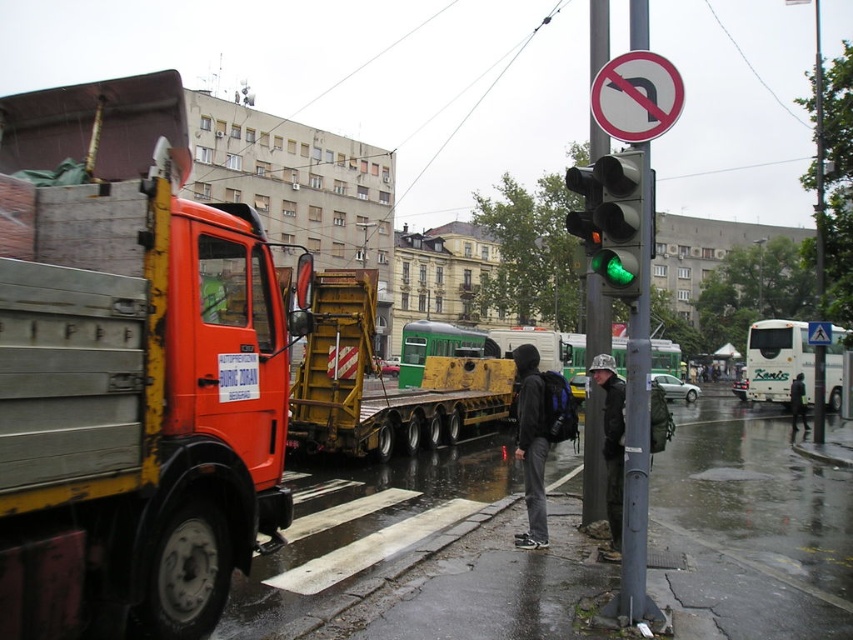
In the scene shown: Who is more distant from viewer, (252,474) or (604,406)?

The point (604,406) is behind.

Does orange metallic truck at left have a greater width compared to dark gray fabric jacket at center?

Yes, orange metallic truck at left is wider than dark gray fabric jacket at center.

This screenshot has width=853, height=640. Identify the location of orange metallic truck at left. (129, 369).

Between orange metallic truck at left and dark gray hoodie at center, which one has more height?

orange metallic truck at left is taller.

Can you confirm if orange metallic truck at left is thinner than dark gray hoodie at center?

No.

The image size is (853, 640). What do you see at coordinates (129, 369) in the screenshot? I see `orange metallic truck at left` at bounding box center [129, 369].

I want to click on orange metallic truck at left, so click(129, 369).

Does yellow metallic flatbed at center appear on the left side of dark gray fabric jacket at center?

Indeed, yellow metallic flatbed at center is positioned on the left side of dark gray fabric jacket at center.

Can you confirm if yellow metallic flatbed at center is smaller than dark gray fabric jacket at center?

No.

At what (x,y) coordinates should I click in order to perform the action: click on yellow metallic flatbed at center. Please return your answer as a coordinate pair (x, y). Image resolution: width=853 pixels, height=640 pixels. Looking at the image, I should click on (381, 384).